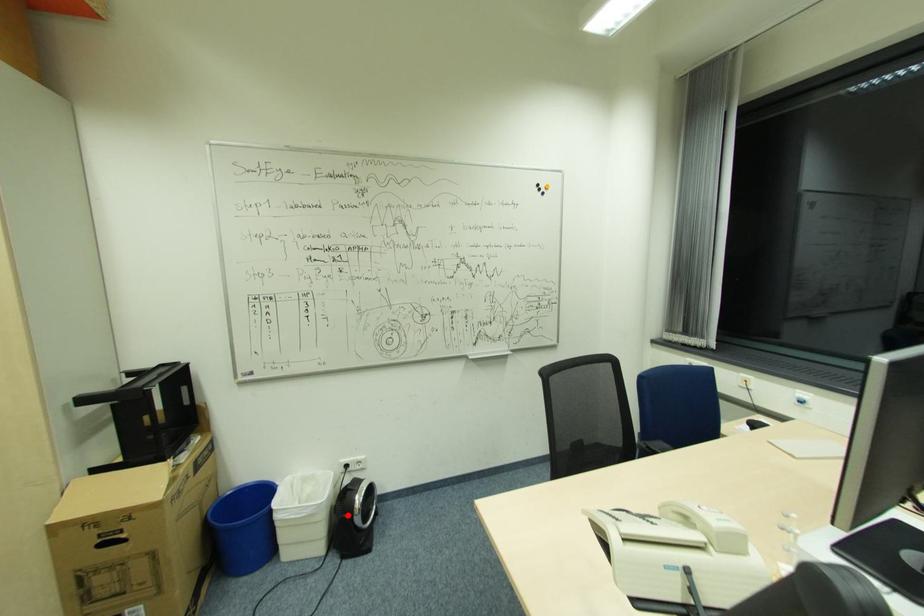
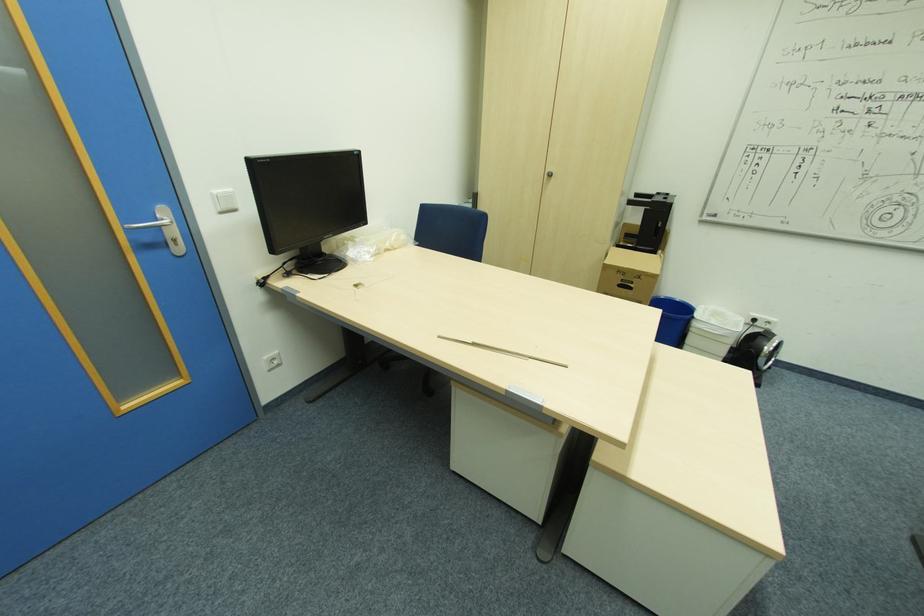
In the second image, find the point that corresponds to the highlighted location in the first image.

(755, 350)